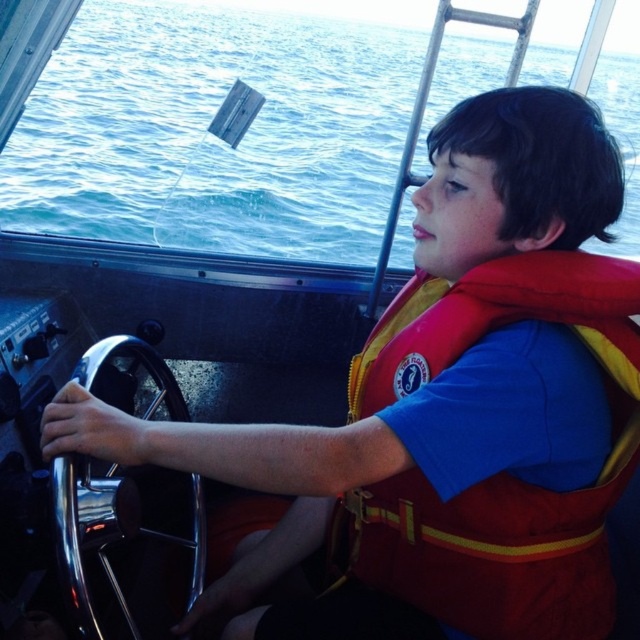
You are navigating a boat and need to determine the distance between two points on your control panel. The points are labeled as point (28, 152) and point (99, 556). Which point is closer to you while sitting in the cockpit?

Point (28, 152) is further to the viewer than point (99, 556), so the point closer to you is point (99, 556).

What is the exact coordinate of the blue water at upper left in the image?

The blue water at upper left is located at point (209, 134).